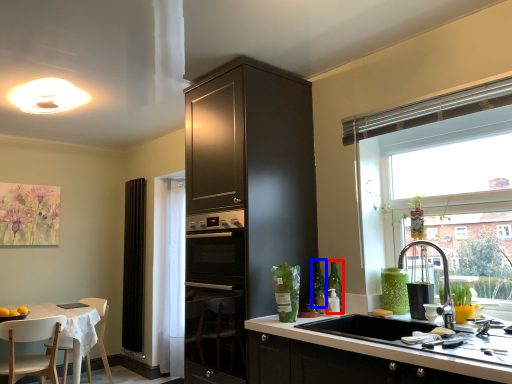
Question: Which point is closer to the camera, bottle (highlighted by a red box) or bottle (highlighted by a blue box)?

Choices:
 (A) bottle
 (B) bottle

Answer: (A)